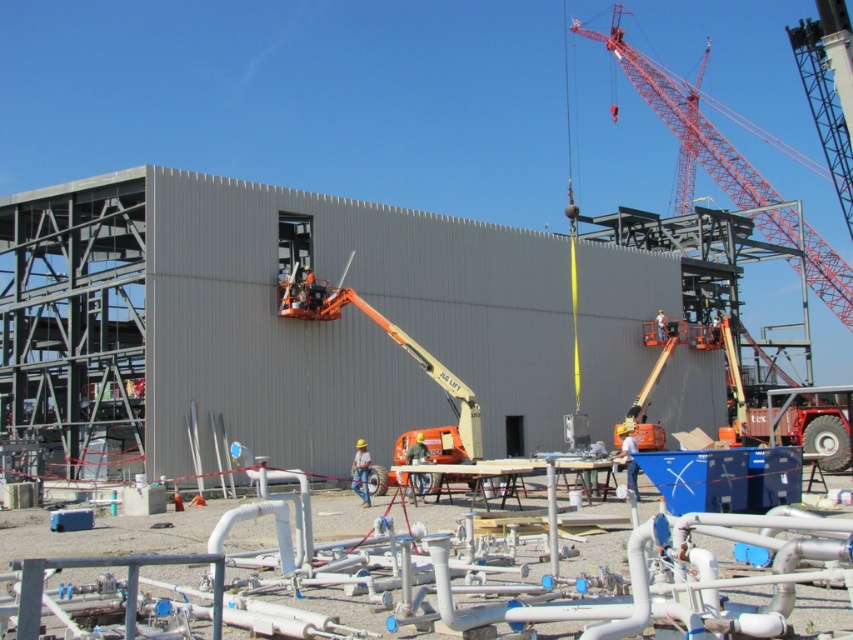
You are an inspector at the construction site. You need to determine which equipment is taller between the red metallic crane at upper right and the orange metallic lift at center. Which one is taller?

The red metallic crane at upper right is taller than the orange metallic lift at center.

In the construction site image, there is a red metallic crane at upper right. Where exactly is it located in terms of coordinates?

The red metallic crane at upper right is located at point coordinates of [698,134].

You are a construction supervisor who needs to move a heavy beam from the red metallic crane at upper right to the orange metallic lift at center. The beam is 70 meters long. Can you safely transport it horizontally between the two without bending or breaking the beam?

The distance between the red metallic crane at upper right and the orange metallic lift at center is 72.32 meters. Since the beam is only 70 meters long, it would be too short to span the distance between them. Therefore, you cannot safely transport it horizontally without bending or breaking the beam.